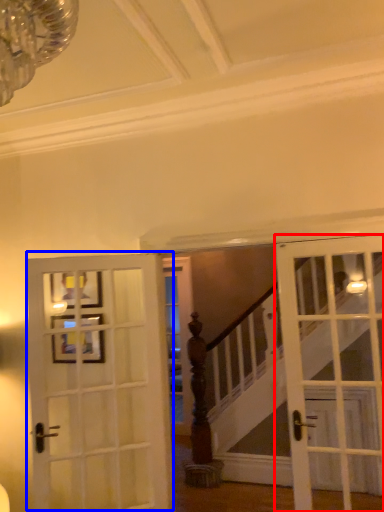
Question: Among these objects, which one is farthest to the camera, door (highlighted by a red box) or door (highlighted by a blue box)?

Choices:
 (A) door
 (B) door

Answer: (B)